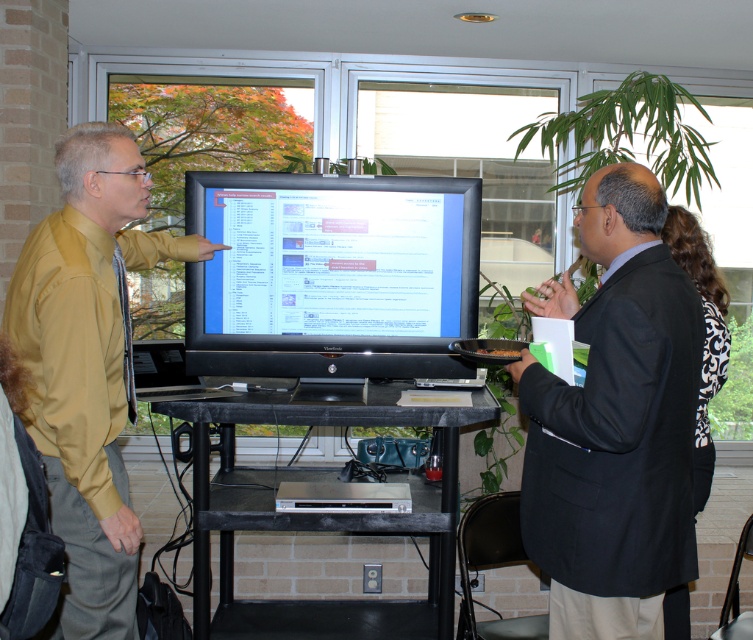
You are standing in front of the television and see two points marked on the screen. Which point is closer to you, the point at coordinates point (410,224) or the point at coordinates point (267,637)?

The point at coordinates point (410,224) is in front of the point at coordinates point (267,637), so it is closer to you.

You are a person with a height of 1.7 meters. You are standing in the same position as the two men in the scene and want to reach the matte black monitor at center to adjust its settings. The monitor requires you to press a button located at its top edge. Can you comfortably reach the button without needing a stool?

The matte black monitor at center is 2.44 meters away from the viewer. Since the monitor is positioned at center and you are standing 2.44 meters away, the height of the monitor and its button would determine reachability. However, the provided information only specifies the distance, not the monitor height. Without knowing the monitor height, it is impossible to determine if you can reach the button comfortably.

You are a photographer setting up a shoot in this room. You need to position a spotlight so that it illuminates both the matte yellow shirt at left and the black damask dress at right equally. Based on their heights, which object should you aim the spotlight higher to reach?

The matte yellow shirt at left is much taller than the black damask dress at right, so you should aim the spotlight higher to reach the matte yellow shirt at left to ensure both are illuminated equally.